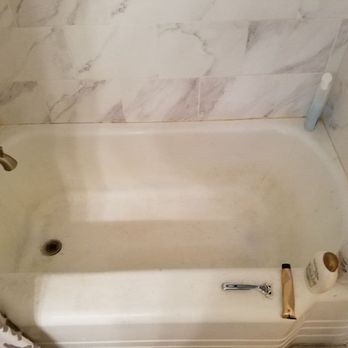
Locate an element on the screen. tub is located at coordinates (183, 276).